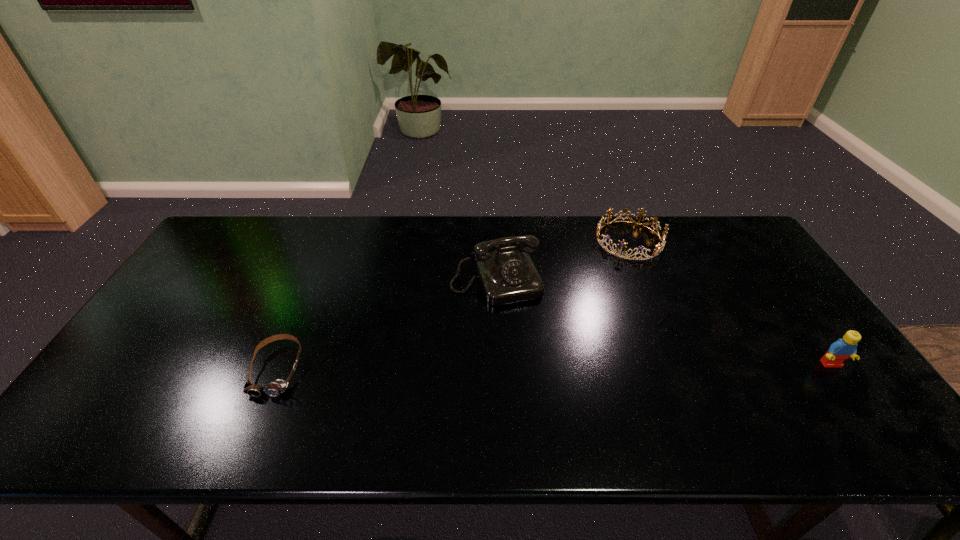
Find the location of a particular element. The image size is (960, 540). vacant space at the far left corner of the desktop is located at coordinates (254, 221).

The image size is (960, 540). In order to click on free space between the telephone and the shortest object in this screenshot , I will do `click(387, 326)`.

Find the location of a particular element. Image resolution: width=960 pixels, height=540 pixels. vacant area that lies between the leftmost object and the third tallest object is located at coordinates (453, 305).

At what (x,y) coordinates should I click in order to perform the action: click on free area in between the third shortest object and the shortest object. Please return your answer as a coordinate pair (x, y). Looking at the image, I should click on (554, 367).

You are a GUI agent. You are given a task and a screenshot of the screen. Output one action in this format:
    pyautogui.click(x=<x>, y=<y>)
    Task: Click on the vacant space that is in between the rightmost object and the second object from right to left
    Image resolution: width=960 pixels, height=540 pixels.
    Given the screenshot: What is the action you would take?
    pyautogui.click(x=731, y=302)

You are a GUI agent. You are given a task and a screenshot of the screen. Output one action in this format:
    pyautogui.click(x=<x>, y=<y>)
    Task: Click on the vacant area that lies between the rightmost object and the telephone
    Image resolution: width=960 pixels, height=540 pixels.
    Given the screenshot: What is the action you would take?
    pyautogui.click(x=663, y=323)

Where is `unoccupied area between the tiara and the leftmost object`? unoccupied area between the tiara and the leftmost object is located at coordinates (453, 305).

Where is `empty location between the third object from right to left and the rightmost object`? The image size is (960, 540). empty location between the third object from right to left and the rightmost object is located at coordinates (663, 323).

Where is `empty space that is in between the leftmost object and the second tallest object`? The width and height of the screenshot is (960, 540). empty space that is in between the leftmost object and the second tallest object is located at coordinates (554, 367).

Where is `vacant point located between the tiara and the leftmost object`? The image size is (960, 540). vacant point located between the tiara and the leftmost object is located at coordinates (453, 305).